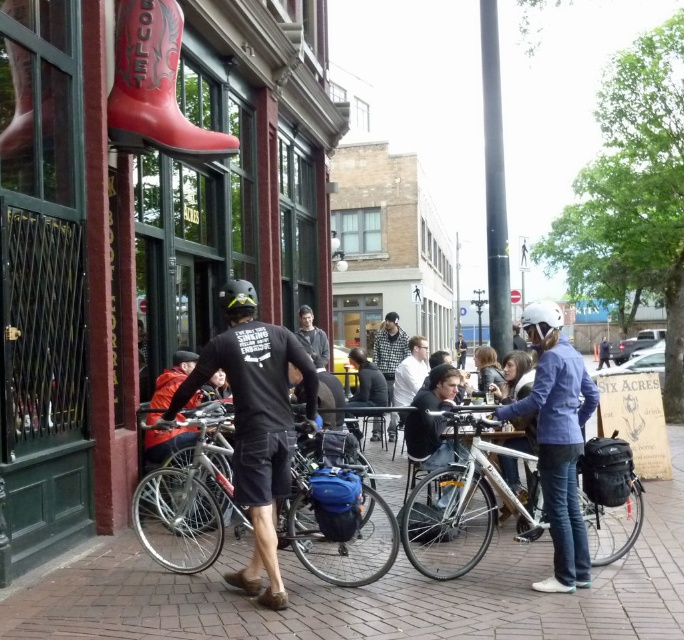
Question: Is brick pavement at center in front of black metallic pole at center?

Choices:
 (A) no
 (B) yes

Answer: (B)

Question: Does brick pavement at center come in front of dark gray sweater at center?

Choices:
 (A) yes
 (B) no

Answer: (A)

Question: Which of the following is the closest to the observer?

Choices:
 (A) (179, 484)
 (B) (244, 307)
 (C) (438, 492)
 (D) (265, 568)

Answer: (D)

Question: Can you confirm if silver metallic bicycle at center is thinner than checkered shirt at center?

Choices:
 (A) no
 (B) yes

Answer: (B)

Question: Which object is closer to the camera taking this photo?

Choices:
 (A) black metallic pole at center
 (B) checkered shirt at center
 (C) white matte bicycle helmet at center

Answer: (C)

Question: Considering the real-world distances, which object is farthest from the dark gray sweater at center?

Choices:
 (A) brick pavement at center
 (B) black matte shirt at center

Answer: (A)